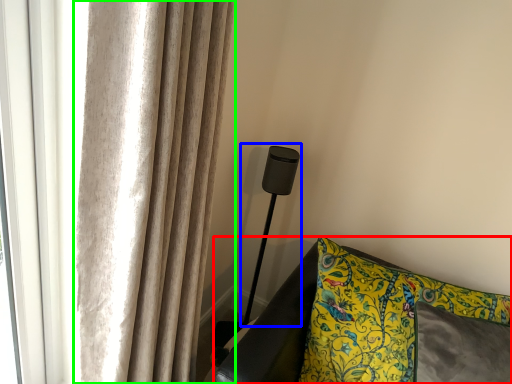
Question: Which object is positioned farthest from furniture (highlighted by a red box)? Select from table lamp (highlighted by a blue box) and curtain (highlighted by a green box).

Choices:
 (A) table lamp
 (B) curtain

Answer: (B)